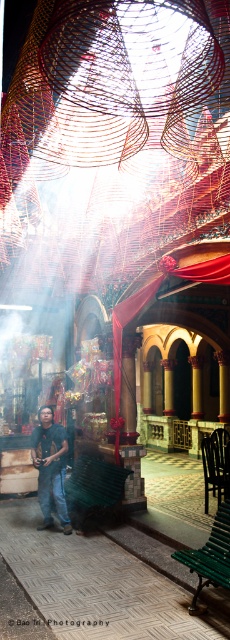
Who is positioned more to the right, green plastic bench at lower center or green wooden bench at lower center?

From the viewer's perspective, green wooden bench at lower center appears more on the right side.

Is point (100, 477) closer to viewer compared to point (186, 561)?

No, it is behind (186, 561).

Between point (78, 484) and point (226, 577), which one is positioned behind?

Positioned behind is point (78, 484).

Image resolution: width=230 pixels, height=640 pixels. Identify the location of green plastic bench at lower center. (94, 488).

Measure the distance between point (68,490) and camera.

8.67 meters

Find the location of `green plastic bench at lower center`. green plastic bench at lower center is located at coordinates (94, 488).

In the scene shown: Does dark gray shirt at center have a larger size compared to green wooden bench at lower center?

Incorrect, dark gray shirt at center is not larger than green wooden bench at lower center.

Can you confirm if dark gray shirt at center is taller than green wooden bench at lower center?

Indeed, dark gray shirt at center has a greater height compared to green wooden bench at lower center.

Is point (34, 454) positioned in front of point (224, 538)?

No, (34, 454) is behind (224, 538).

The image size is (230, 640). I want to click on dark gray shirt at center, so click(x=51, y=467).